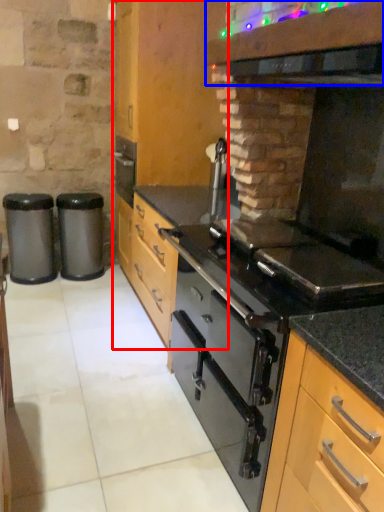
Question: Among these objects, which one is nearest to the camera, cabinetry (highlighted by a red box) or vent (highlighted by a blue box)?

Choices:
 (A) cabinetry
 (B) vent

Answer: (B)